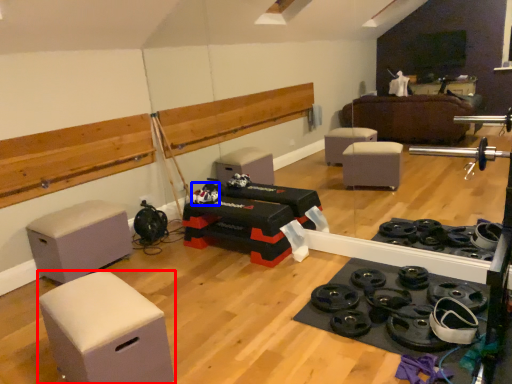
Question: Which object is further to the camera taking this photo, furniture (highlighted by a red box) or toy (highlighted by a blue box)?

Choices:
 (A) furniture
 (B) toy

Answer: (B)